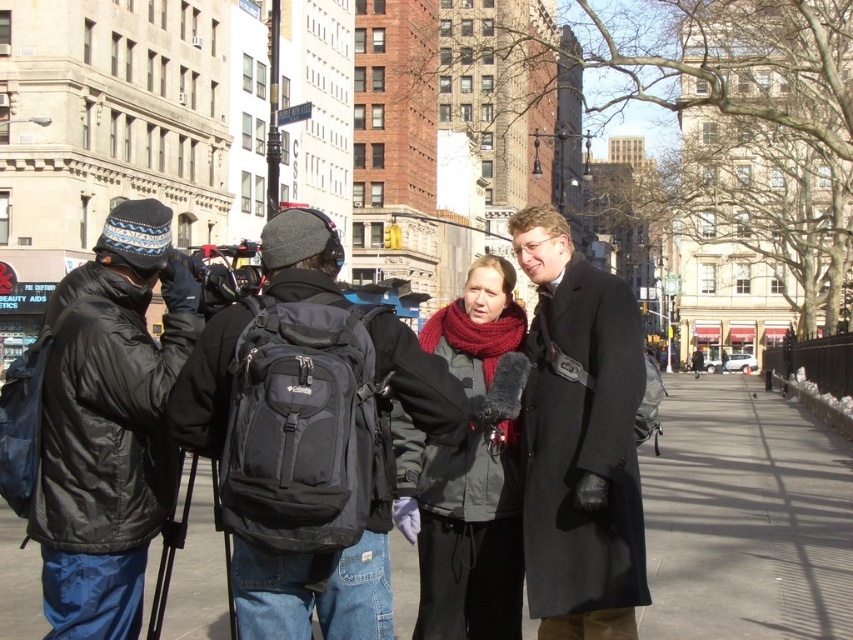
Question: Can you confirm if black fabric pavement at center is smaller than black matte jacket at left?

Choices:
 (A) no
 (B) yes

Answer: (A)

Question: Does black fabric pavement at center come in front of black matte jacket at left?

Choices:
 (A) yes
 (B) no

Answer: (B)

Question: Which object is positioned closest to the dark gray wool scarf at center?

Choices:
 (A) black matte jacket at left
 (B) matte black coat at center
 (C) black fabric pavement at center

Answer: (B)

Question: Is black fabric pavement at center above black matte jacket at left?

Choices:
 (A) yes
 (B) no

Answer: (B)

Question: Which of the following is the farthest from the observer?

Choices:
 (A) black nylon backpack at center
 (B) dark gray wool scarf at center

Answer: (B)

Question: Which of these objects is positioned closest to the black fabric pavement at center?

Choices:
 (A) matte black coat at center
 (B) black nylon backpack at center
 (C) black matte jacket at left

Answer: (C)